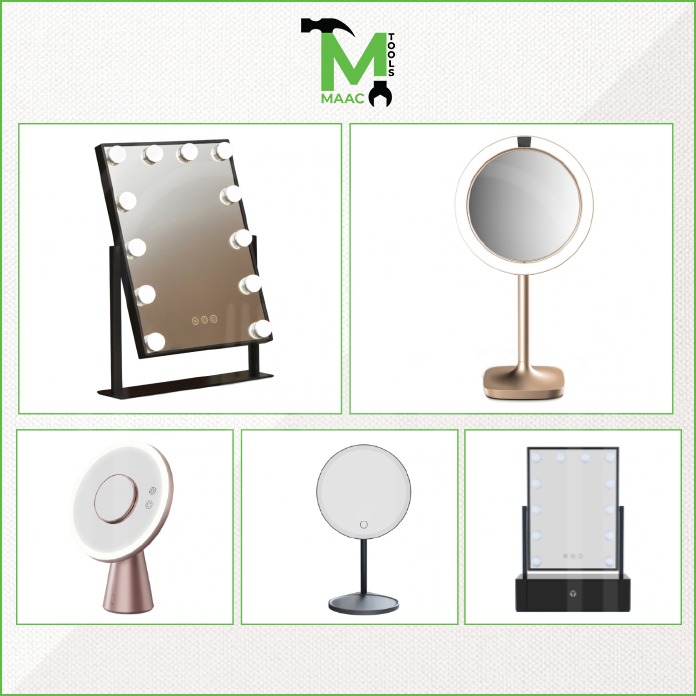
The width and height of the screenshot is (696, 696). What are the coordinates of `bottom right side of mirror globe light` in the screenshot? It's located at click(262, 332).